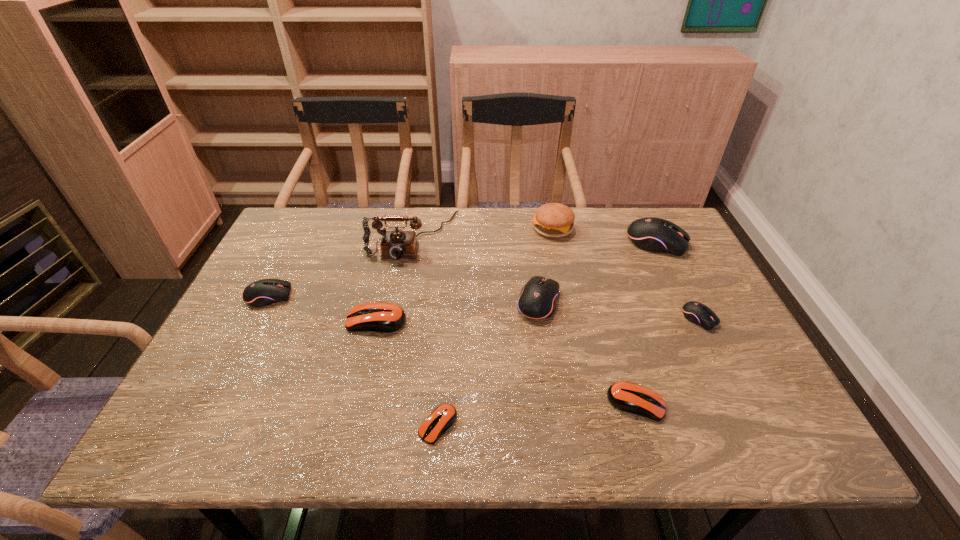
What are the coordinates of `vacant space that is in between the tallest computer mouse and the hamburger` in the screenshot? It's located at (605, 235).

At what (x,y) coordinates should I click in order to perform the action: click on free area in between the farthest orange computer mouse and the third black computer mouse from right to left. Please return your answer as a coordinate pair (x, y). This screenshot has width=960, height=540. Looking at the image, I should click on (458, 312).

The width and height of the screenshot is (960, 540). I want to click on free space between the second orange computer mouse from left to right and the biggest orange computer mouse, so click(407, 373).

Locate an element on the screen. The image size is (960, 540). empty space between the biggest orange computer mouse and the farthest black computer mouse is located at coordinates (516, 282).

Locate an element on the screen. The width and height of the screenshot is (960, 540). free spot between the hamburger and the second computer mouse from left to right is located at coordinates (465, 275).

I want to click on object that ranks as the fifth closest to the smallest black computer mouse, so click(443, 417).

Locate an element on the screen. This screenshot has height=540, width=960. object that is the sixth closest one to the fifth computer mouse from right to left is located at coordinates (x=698, y=313).

Identify the location of computer mouse that is the fourth closest to the rightmost orange computer mouse. (651, 234).

Where is `the second closest computer mouse to the leftmost computer mouse`? This screenshot has width=960, height=540. the second closest computer mouse to the leftmost computer mouse is located at coordinates (443, 417).

Find the location of a particular element. the third closest black computer mouse to the smallest black computer mouse is located at coordinates (261, 293).